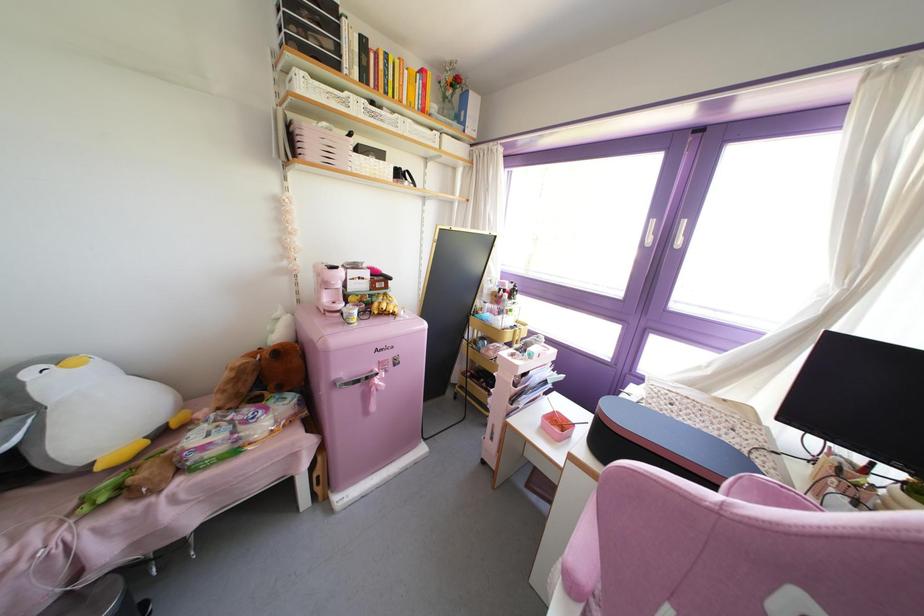
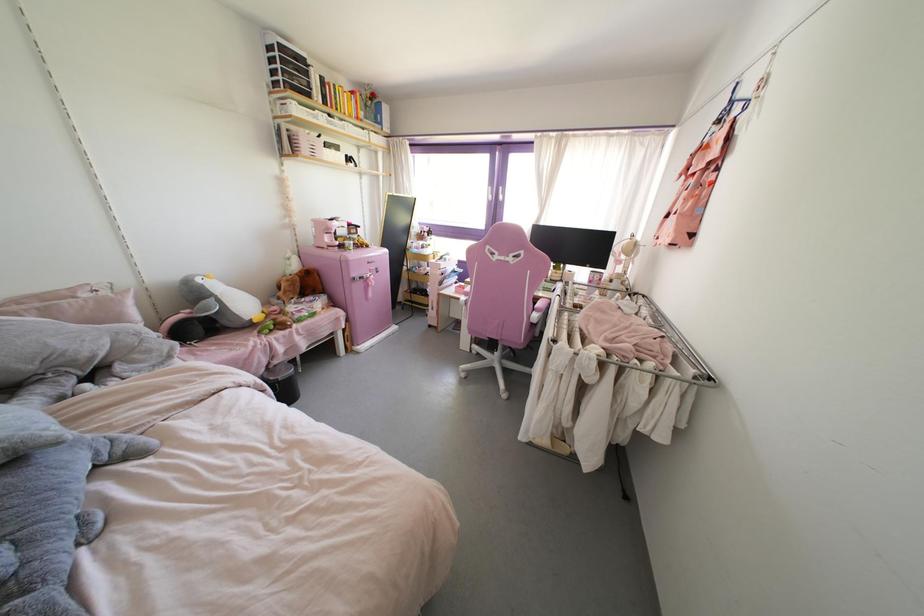
In the second image, find the point that corresponds to (x=371, y=160) in the first image.

(333, 151)